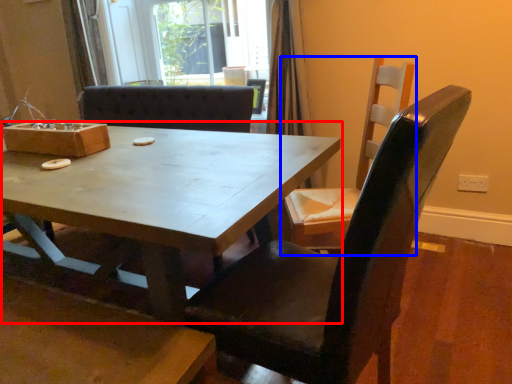
Question: Which point is further to the camera, coffee table (highlighted by a red box) or chair (highlighted by a blue box)?

Choices:
 (A) coffee table
 (B) chair

Answer: (B)